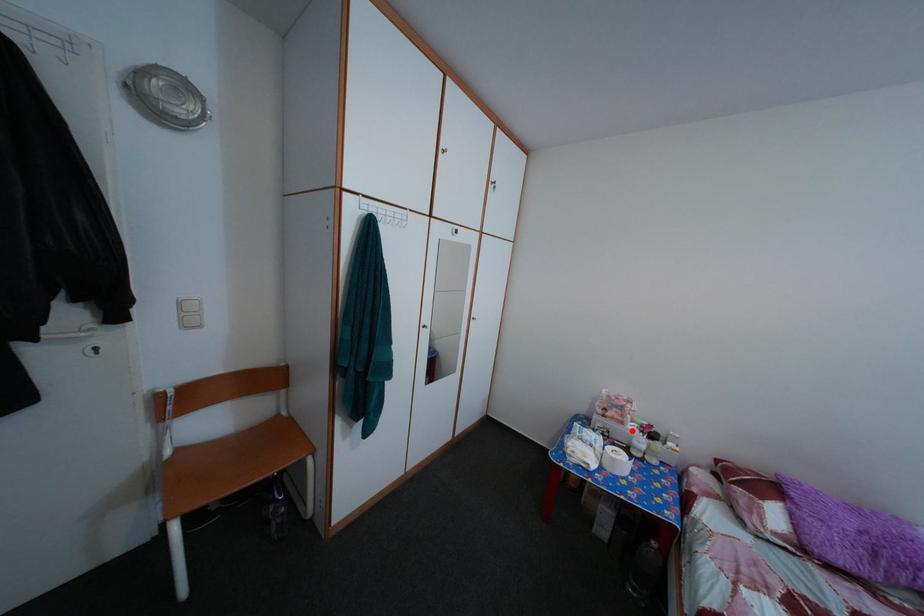
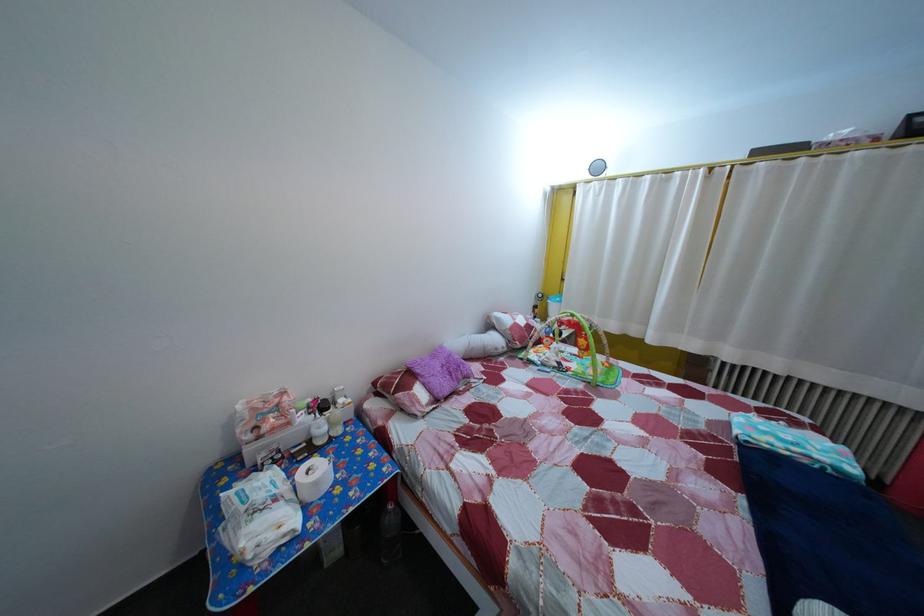
Question: A red point is marked in image1. In image2, is the corresponding 3D point closer to the camera or farther? Reply with the corresponding letter.

Choices:
 (A) The corresponding 3D point is closer.
 (B) The corresponding 3D point is farther.

Answer: (A)